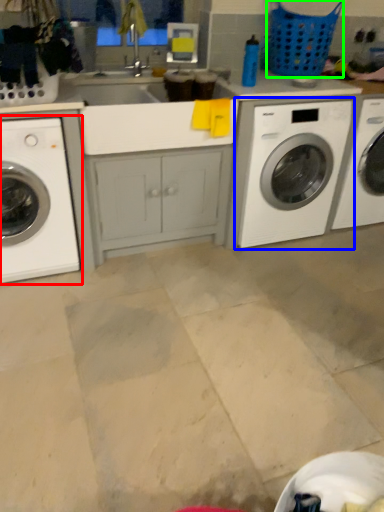
Question: Which object is the closest to the washing machine (highlighted by a red box)? Choose among these: washing machine (highlighted by a blue box) or basket (highlighted by a green box).

Choices:
 (A) washing machine
 (B) basket

Answer: (A)